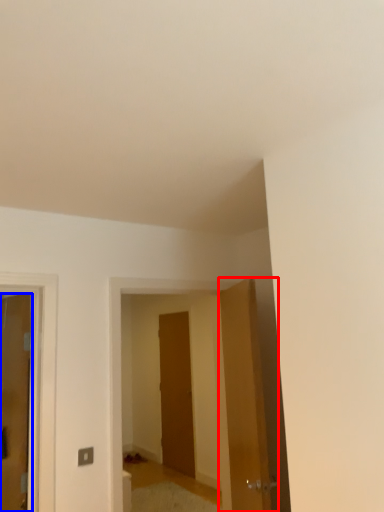
Question: Which of the following is the farthest to the observer, door (highlighted by a red box) or door (highlighted by a blue box)?

Choices:
 (A) door
 (B) door

Answer: (B)